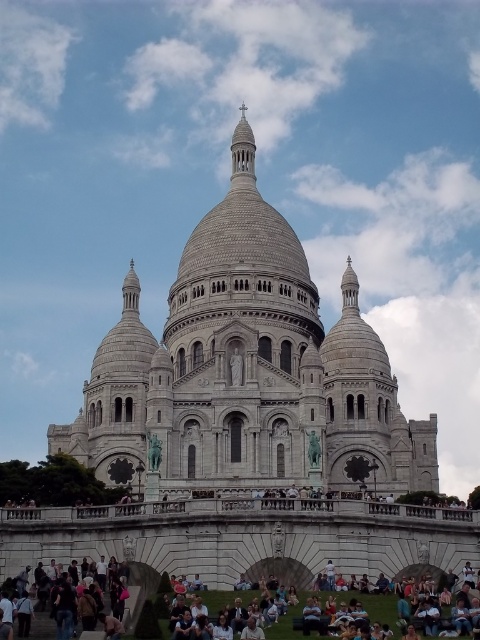
You are standing at the lower center of the image where the dark blue jeans at lower center are placed. Looking up, can you see the light gray stone cathedral at center?

Yes, because the light gray stone cathedral at center is above the dark blue jeans at lower center, so when standing at the dark blue jeans at lower center, looking up would allow you to see the light gray stone cathedral at center.

You are a tourist standing at the base of the light gray stone cathedral at center and looking up. You notice the dark blue jeans at lower center in your line of sight. Which object appears larger in your view?

The light gray stone cathedral at center appears larger in your view because it is taller than the dark blue jeans at lower center.

You are standing on the street looking at the light gray stone cathedral at center and the dark blue jeans at lower center. Which object is positioned to the right side?

The dark blue jeans at lower center is positioned to the right of the light gray stone cathedral at center.